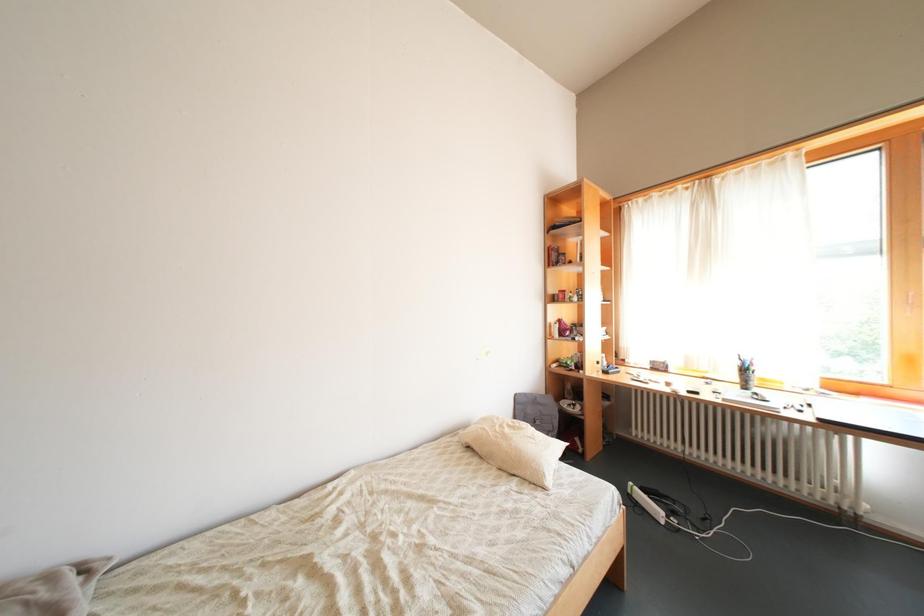
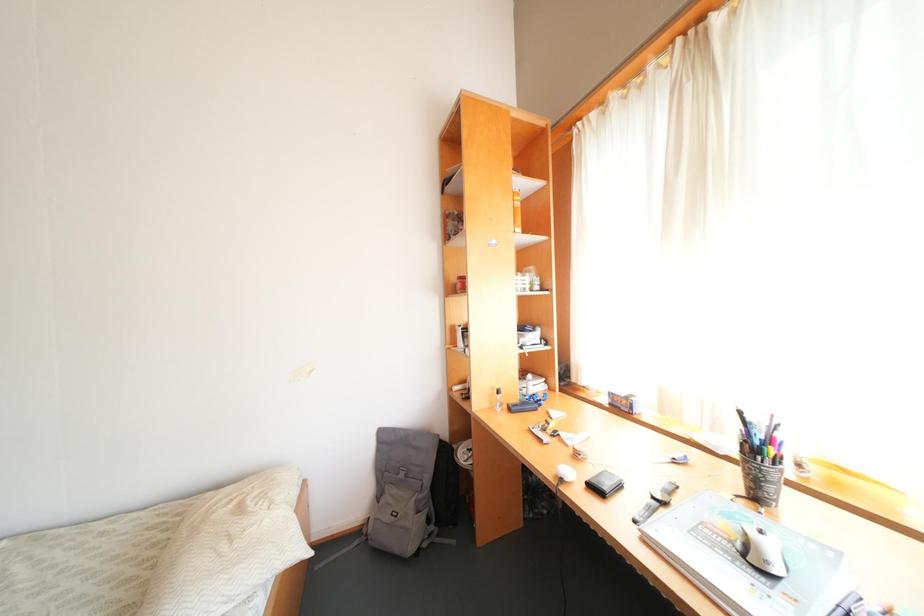
From the picture: In a continuous first-person perspective shot, in which direction is the camera moving?

The movement direction of the cameraman is right, forward.